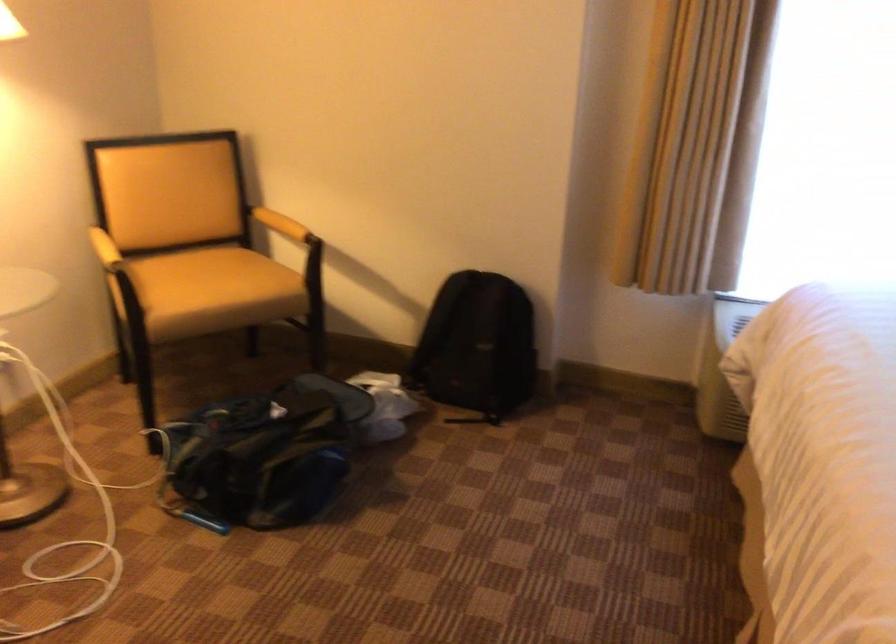
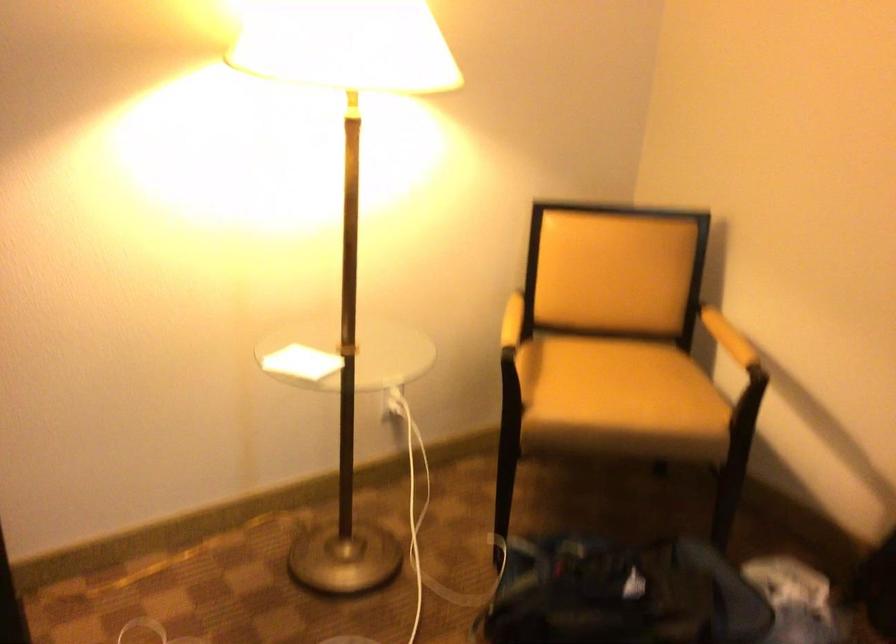
Locate, in the second image, the point that corresponds to point 114,240 in the first image.

(512, 321)